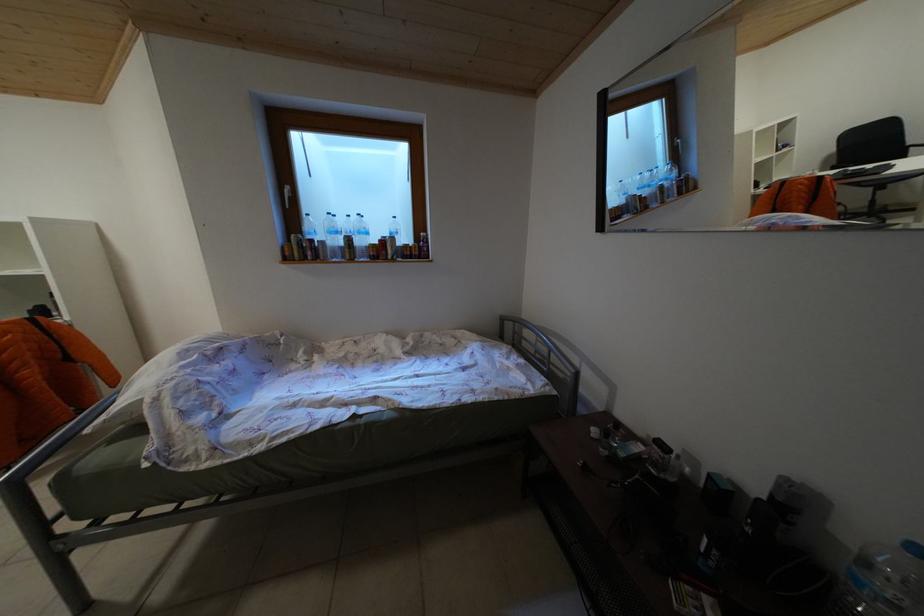
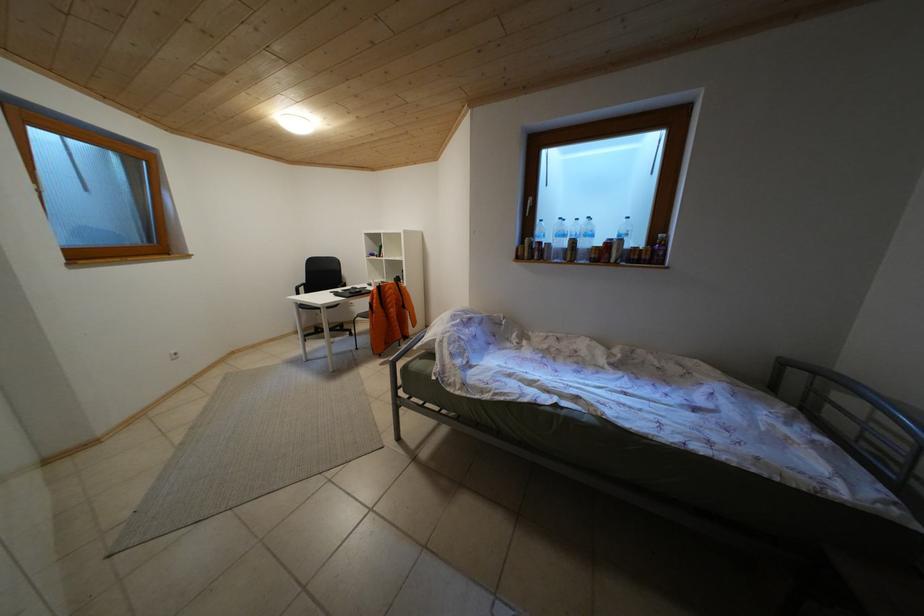
Question: How did the camera likely rotate?

Choices:
 (A) Left
 (B) Right
 (C) Up
 (D) Down

Answer: (A)